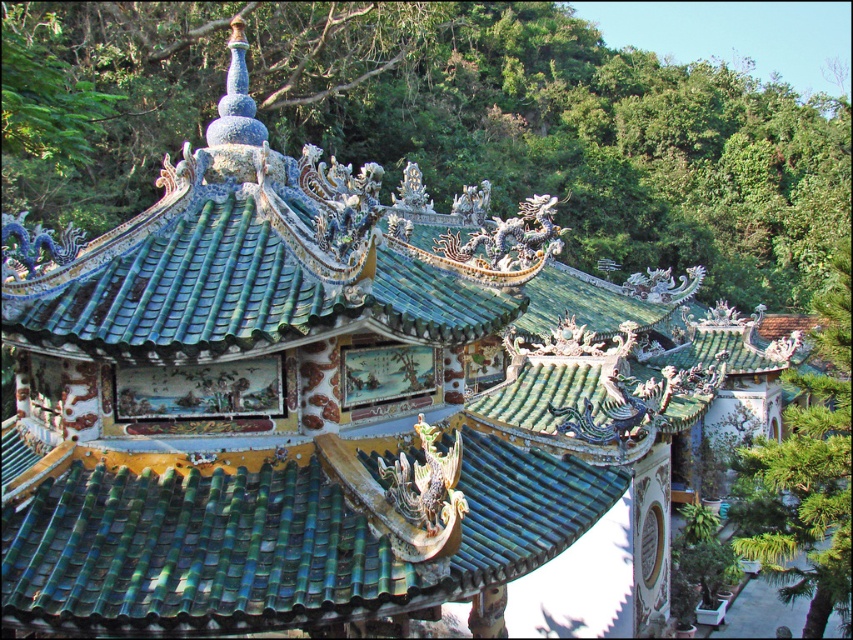
Does green leafy tree at upper center appear on the left side of green glazed tiles at center?

Incorrect, green leafy tree at upper center is not on the left side of green glazed tiles at center.

Who is positioned more to the right, green leafy tree at upper center or green glazed tiles at center?

From the viewer's perspective, green leafy tree at upper center appears more on the right side.

This screenshot has width=853, height=640. Find the location of `green leafy tree at upper center`. green leafy tree at upper center is located at coordinates (442, 124).

From the picture: Is green leafy tree at upper center below green leafy tree at right?

No, green leafy tree at upper center is not below green leafy tree at right.

In the scene shown: Is green leafy tree at upper center bigger than green leafy tree at right?

Yes, green leafy tree at upper center is bigger than green leafy tree at right.

Identify the location of green leafy tree at upper center. This screenshot has height=640, width=853. (442, 124).

Identify the location of green leafy tree at upper center. The image size is (853, 640). (442, 124).

Who is positioned more to the right, green glazed tiles at center or green leafy tree at right?

Positioned to the right is green leafy tree at right.

Which of these two, green glazed tiles at center or green leafy tree at right, stands shorter?

With less height is green glazed tiles at center.

I want to click on green glazed tiles at center, so click(x=271, y=544).